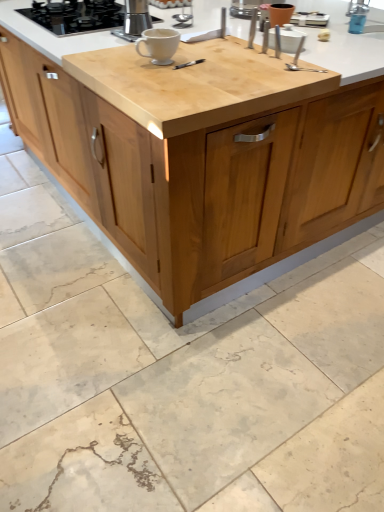
Question: From the image's perspective, is black glass gas stove at upper left located above or below light brown wood cabinet at center?

Choices:
 (A) above
 (B) below

Answer: (A)

Question: From their relative heights in the image, would you say black glass gas stove at upper left is taller or shorter than light brown wood cabinet at center?

Choices:
 (A) short
 (B) tall

Answer: (A)

Question: Considering the real-world distances, which object is farthest from the black glass gas stove at upper left?

Choices:
 (A) blue plastic faucet at upper right
 (B) satin silver spoon at upper right
 (C) light brown wood cabinet at center
 (D) satin silver espresso maker at upper center
 (E) matte brown pot at upper right

Answer: (A)

Question: Which is nearer to the matte brown pot at upper right?

Choices:
 (A) blue plastic faucet at upper right
 (B) satin silver spoon at upper right
 (C) white glossy mug at center
 (D) satin silver espresso maker at upper center
 (E) light brown wood cabinet at center

Answer: (A)